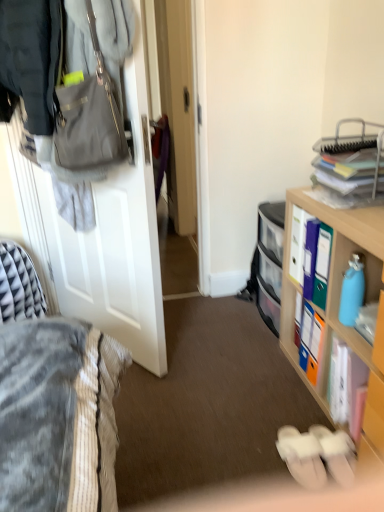
Where is `vacant area that is in front of white fabric slippers at lower center, the 2th footwear viewed from the right`? vacant area that is in front of white fabric slippers at lower center, the 2th footwear viewed from the right is located at coordinates (299, 497).